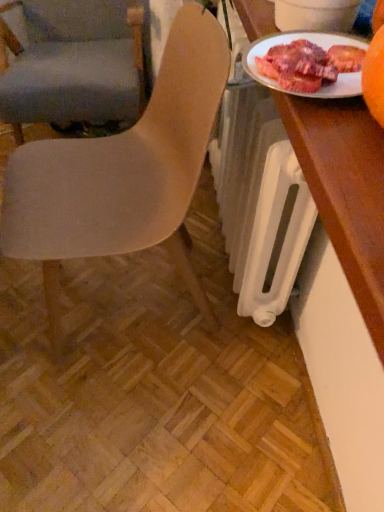
Question: Considering the positions of wooden desk at right and matte gray chair at left, the second chair from the front, in the image, is wooden desk at right wider or thinner than matte gray chair at left, the second chair from the front,?

Choices:
 (A) thin
 (B) wide

Answer: (A)

Question: In the image, is wooden desk at right on the left side or the right side of matte gray chair at left, the second chair from the front?

Choices:
 (A) right
 (B) left

Answer: (A)

Question: Which of these objects is positioned closest to the matte gray chair at left, the second chair from the front?

Choices:
 (A) wooden desk at right
 (B) matte beige chair at center, which is the first chair in front-to-back order
 (C) white glossy plate at upper right

Answer: (B)

Question: Estimate the real-world distances between objects in this image. Which object is closer to the matte gray chair at left, the second chair from the front?

Choices:
 (A) white glossy plate at upper right
 (B) wooden desk at right
 (C) matte beige chair at center, which is the first chair in front-to-back order

Answer: (C)